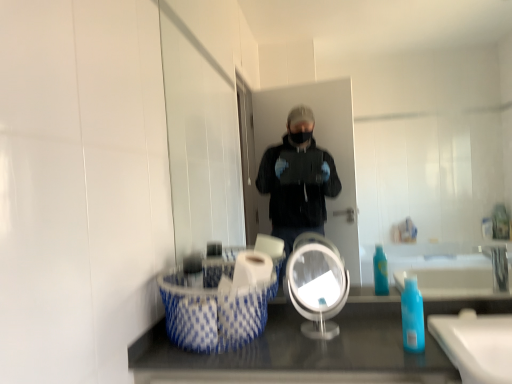
The height and width of the screenshot is (384, 512). Identify the location of clear plastic mirror at center, positioned as the 2th mirror in back-to-front order. (317, 284).

This screenshot has height=384, width=512. Describe the element at coordinates (317, 284) in the screenshot. I see `clear plastic mirror at center, the first mirror positioned from the front` at that location.

What are the coordinates of `clear glass mirror at center, which is the 1th mirror from back to front` in the screenshot? It's located at (388, 94).

From the image's perspective, is blue and white woven laundry basket at lower left under blue translucent bottle at lower right?

Yes.

At what (x,y) coordinates should I click in order to perform the action: click on laundry basket that is above the blue translucent bottle at lower right (from a real-world perspective). Please return your answer as a coordinate pair (x, y). This screenshot has height=384, width=512. Looking at the image, I should click on (216, 306).

Is blue and white woven laundry basket at lower left shorter than blue translucent bottle at lower right?

No.

From the image's perspective, which one is positioned lower, white glossy toilet paper at center or clear plastic mirror at center, the first mirror positioned from the front?

clear plastic mirror at center, the first mirror positioned from the front, from the image's perspective.

In the scene shown: Considering their positions, is white glossy toilet paper at center located in front of or behind clear plastic mirror at center, positioned as the 2th mirror in back-to-front order?

Clearly, white glossy toilet paper at center is behind clear plastic mirror at center, positioned as the 2th mirror in back-to-front order.

Considering the relative sizes of white glossy toilet paper at center and clear plastic mirror at center, the first mirror positioned from the front, in the image provided, is white glossy toilet paper at center bigger than clear plastic mirror at center, the first mirror positioned from the front,?

No, white glossy toilet paper at center is not bigger than clear plastic mirror at center, the first mirror positioned from the front.

How much distance is there between white glossy toilet paper at center and clear plastic mirror at center, the first mirror positioned from the front?

white glossy toilet paper at center and clear plastic mirror at center, the first mirror positioned from the front, are 5.37 inches apart.

Is blue translucent bottle at lower right located outside clear glass mirror at center, which is the 1th mirror from back to front?

That's correct, blue translucent bottle at lower right is outside of clear glass mirror at center, which is the 1th mirror from back to front.

Between blue translucent bottle at lower right and clear glass mirror at center, which is the 1th mirror from back to front, which one appears on the left side from the viewer's perspective?

Positioned to the left is clear glass mirror at center, which is the 1th mirror from back to front.

Which is behind, point (416, 327) or point (425, 13)?

The point (425, 13) is behind.

Is the position of blue translucent bottle at lower right less distant than that of clear glass mirror at center, which is the 1th mirror from back to front?

Yes, the depth of blue translucent bottle at lower right is less than that of clear glass mirror at center, which is the 1th mirror from back to front.

Considering the points (336, 308) and (243, 36), which point is behind, point (336, 308) or point (243, 36)?

Point (243, 36)

What's the angular difference between clear plastic mirror at center, positioned as the 2th mirror in back-to-front order, and clear glass mirror at center, which is the 1th mirror from back to front,'s facing directions?

They differ by 36.1 degrees in their facing directions.

Looking at this image, is clear plastic mirror at center, the first mirror positioned from the front, aimed at clear glass mirror at center, the second mirror viewed from the front?

No, clear plastic mirror at center, the first mirror positioned from the front, does not turn towards clear glass mirror at center, the second mirror viewed from the front.

Would you say clear glass mirror at center, which is the 1th mirror from back to front, contains blue and white woven laundry basket at lower left?

No, blue and white woven laundry basket at lower left is not a part of clear glass mirror at center, which is the 1th mirror from back to front.

From the image's perspective, is clear glass mirror at center, which is the 1th mirror from back to front, on top of blue and white woven laundry basket at lower left?

Yes, from the image's perspective, clear glass mirror at center, which is the 1th mirror from back to front, is on top of blue and white woven laundry basket at lower left.

Is blue and white woven laundry basket at lower left a part of white glossy toilet paper at center?

No, white glossy toilet paper at center does not contain blue and white woven laundry basket at lower left.

Image resolution: width=512 pixels, height=384 pixels. What are the coordinates of `laundry basket in front of the white glossy toilet paper at center` in the screenshot? It's located at (216, 306).

Is white glossy toilet paper at center far from blue and white woven laundry basket at lower left?

white glossy toilet paper at center is actually quite close to blue and white woven laundry basket at lower left.

Could you measure the distance between white glossy toilet paper at center and blue and white woven laundry basket at lower left?

The distance of white glossy toilet paper at center from blue and white woven laundry basket at lower left is 3.76 inches.

Considering the positions of objects blue and white woven laundry basket at lower left and clear plastic mirror at center, the first mirror positioned from the front, in the image provided, who is more to the right, blue and white woven laundry basket at lower left or clear plastic mirror at center, the first mirror positioned from the front,?

Positioned to the right is clear plastic mirror at center, the first mirror positioned from the front.

From a real-world perspective, relative to clear plastic mirror at center, the first mirror positioned from the front, is blue and white woven laundry basket at lower left vertically above or below?

In terms of real-world spatial position, blue and white woven laundry basket at lower left is below clear plastic mirror at center, the first mirror positioned from the front.

Could you tell me if blue and white woven laundry basket at lower left is turned towards clear plastic mirror at center, the first mirror positioned from the front?

No, blue and white woven laundry basket at lower left is not turned towards clear plastic mirror at center, the first mirror positioned from the front.

Can you see blue and white woven laundry basket at lower left touching clear plastic mirror at center, the first mirror positioned from the front?

No, blue and white woven laundry basket at lower left is not in contact with clear plastic mirror at center, the first mirror positioned from the front.

This screenshot has width=512, height=384. In order to click on soap dispenser on the right of blue and white woven laundry basket at lower left in this screenshot , I will do `click(412, 316)`.

Locate an element on the screen. The image size is (512, 384). toilet paper above the clear plastic mirror at center, the first mirror positioned from the front (from a real-world perspective) is located at coordinates (251, 271).

Considering their positions, is white glossy toilet paper at center positioned further to blue and white woven laundry basket at lower left than blue translucent bottle at lower right?

blue translucent bottle at lower right is positioned further to the anchor blue and white woven laundry basket at lower left.

When comparing their distances from clear plastic mirror at center, the first mirror positioned from the front, does clear glass mirror at center, the second mirror viewed from the front, or blue and white woven laundry basket at lower left seem further?

Among the two, clear glass mirror at center, the second mirror viewed from the front, is located further to clear plastic mirror at center, the first mirror positioned from the front.

Looking at the image, which one is located closer to white glossy toilet paper at center, blue and white woven laundry basket at lower left or blue translucent bottle at lower right?

blue and white woven laundry basket at lower left is closer to white glossy toilet paper at center.

When comparing their distances from clear plastic mirror at center, the first mirror positioned from the front, does blue and white woven laundry basket at lower left or blue translucent bottle at lower right seem closer?

blue and white woven laundry basket at lower left is positioned closer to the anchor clear plastic mirror at center, the first mirror positioned from the front.

Based on their spatial positions, is clear plastic mirror at center, the first mirror positioned from the front, or blue and white woven laundry basket at lower left further from clear glass mirror at center, the second mirror viewed from the front?

Among the two, clear plastic mirror at center, the first mirror positioned from the front, is located further to clear glass mirror at center, the second mirror viewed from the front.

Based on the photo, from the image, which object appears to be farther from white glossy toilet paper at center, clear plastic mirror at center, the first mirror positioned from the front, or blue translucent bottle at lower right?

The object further to white glossy toilet paper at center is blue translucent bottle at lower right.

Estimate the real-world distances between objects in this image. Which object is closer to blue and white woven laundry basket at lower left, clear plastic mirror at center, positioned as the 2th mirror in back-to-front order, or clear glass mirror at center, the second mirror viewed from the front?

clear plastic mirror at center, positioned as the 2th mirror in back-to-front order.

Estimate the real-world distances between objects in this image. Which object is further from blue translucent bottle at lower right, clear glass mirror at center, which is the 1th mirror from back to front, or clear plastic mirror at center, the first mirror positioned from the front?

clear glass mirror at center, which is the 1th mirror from back to front, lies further to blue translucent bottle at lower right than the other object.

The width and height of the screenshot is (512, 384). Find the location of `toilet paper between clear glass mirror at center, which is the 1th mirror from back to front, and clear plastic mirror at center, the first mirror positioned from the front, in the up-down direction`. toilet paper between clear glass mirror at center, which is the 1th mirror from back to front, and clear plastic mirror at center, the first mirror positioned from the front, in the up-down direction is located at coordinates (251, 271).

Where is `mirror between clear glass mirror at center, which is the 1th mirror from back to front, and blue and white woven laundry basket at lower left from top to bottom`? mirror between clear glass mirror at center, which is the 1th mirror from back to front, and blue and white woven laundry basket at lower left from top to bottom is located at coordinates (317, 284).

Identify the location of toilet paper between clear glass mirror at center, the second mirror viewed from the front, and blue and white woven laundry basket at lower left in the up-down direction. The height and width of the screenshot is (384, 512). (251, 271).

The image size is (512, 384). Identify the location of soap dispenser between clear glass mirror at center, which is the 1th mirror from back to front, and blue and white woven laundry basket at lower left, in the vertical direction. (412, 316).